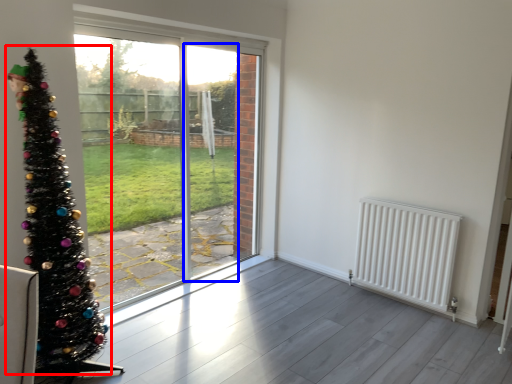
Question: Which object is closer to the camera taking this photo, christmas tree (highlighted by a red box) or screen door (highlighted by a blue box)?

Choices:
 (A) christmas tree
 (B) screen door

Answer: (A)